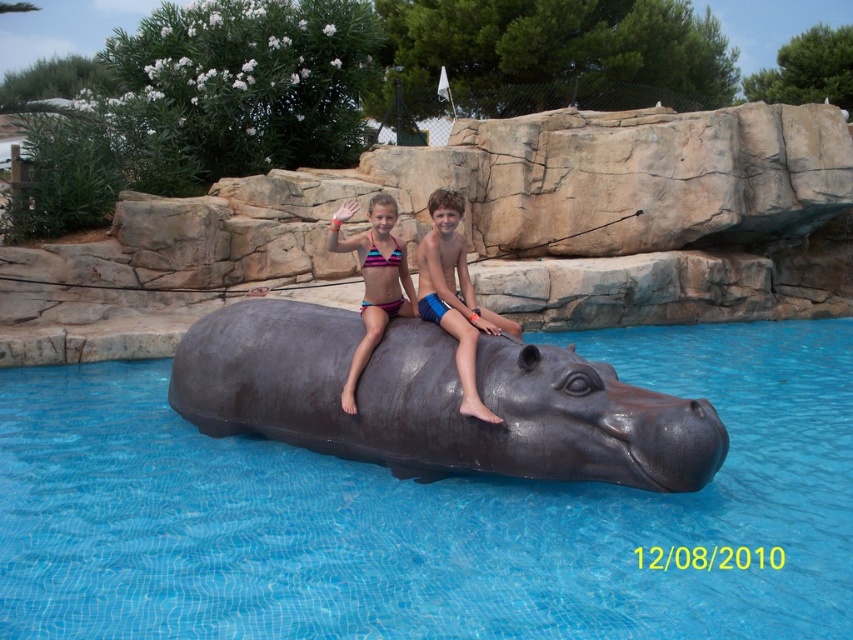
Question: Which object is farther from the camera taking this photo?

Choices:
 (A) striped fabric bikini at center
 (B) blue matte/soft shorts at center
 (C) shiny dark gray hippo at center
 (D) glossy plastic hippo at center

Answer: (A)

Question: Is glossy plastic hippo at center below striped fabric bikini at center?

Choices:
 (A) no
 (B) yes

Answer: (B)

Question: Which object is positioned closest to the striped fabric bikini at center?

Choices:
 (A) blue matte/soft shorts at center
 (B) shiny dark gray hippo at center

Answer: (A)

Question: Can you confirm if glossy plastic hippo at center is bigger than blue matte/soft shorts at center?

Choices:
 (A) yes
 (B) no

Answer: (A)

Question: Which of these objects is positioned farthest from the blue matte/soft shorts at center?

Choices:
 (A) striped fabric bikini at center
 (B) glossy plastic hippo at center

Answer: (B)

Question: Is the position of glossy plastic hippo at center more distant than that of shiny dark gray hippo at center?

Choices:
 (A) no
 (B) yes

Answer: (A)